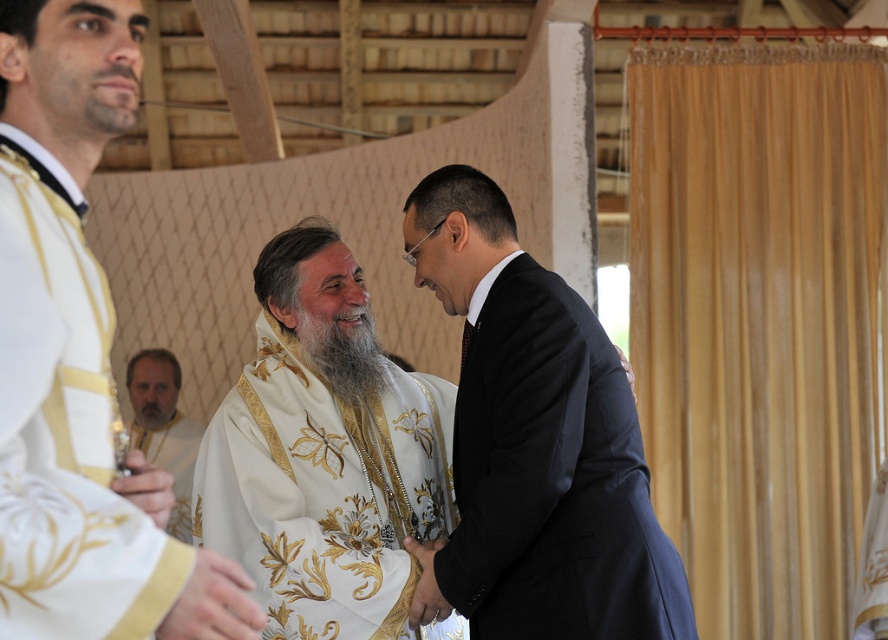
Where is `white embroidered robe at left`? white embroidered robe at left is located at coordinates (67, 433).

At what (x,y) coordinates should I click in order to perform the action: click on white embroidered robe at left. Please return your answer as a coordinate pair (x, y). The image size is (888, 640). Looking at the image, I should click on (67, 433).

The height and width of the screenshot is (640, 888). Find the location of `white embroidered robe at left`. white embroidered robe at left is located at coordinates (67, 433).

Consider the image. Can you confirm if white embroidered robe at center is positioned below white satin hand at center?

No.

Between white embroidered robe at center and white satin hand at center, which one has less height?

white satin hand at center is shorter.

The width and height of the screenshot is (888, 640). What do you see at coordinates (324, 452) in the screenshot?
I see `white embroidered robe at center` at bounding box center [324, 452].

I want to click on white embroidered robe at center, so click(x=324, y=452).

Does white embroidered robe at center appear over dark blue wool suit at center?

Yes.

Who is positioned more to the right, white embroidered robe at center or dark blue wool suit at center?

Positioned to the right is dark blue wool suit at center.

What do you see at coordinates (324, 452) in the screenshot?
I see `white embroidered robe at center` at bounding box center [324, 452].

I want to click on white embroidered robe at center, so click(x=324, y=452).